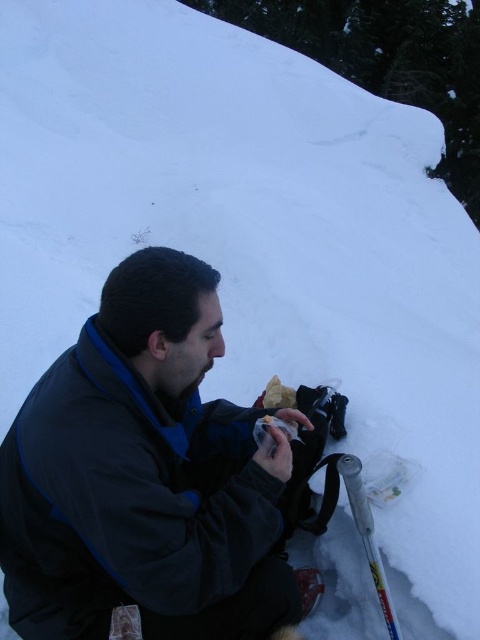
Who is taller, dark blue fleece jacket at center or silver metallic ski pole at lower right?

dark blue fleece jacket at center is taller.

The image size is (480, 640). Describe the element at coordinates (145, 476) in the screenshot. I see `dark blue fleece jacket at center` at that location.

Locate an element on the screen. The image size is (480, 640). dark blue fleece jacket at center is located at coordinates (145, 476).